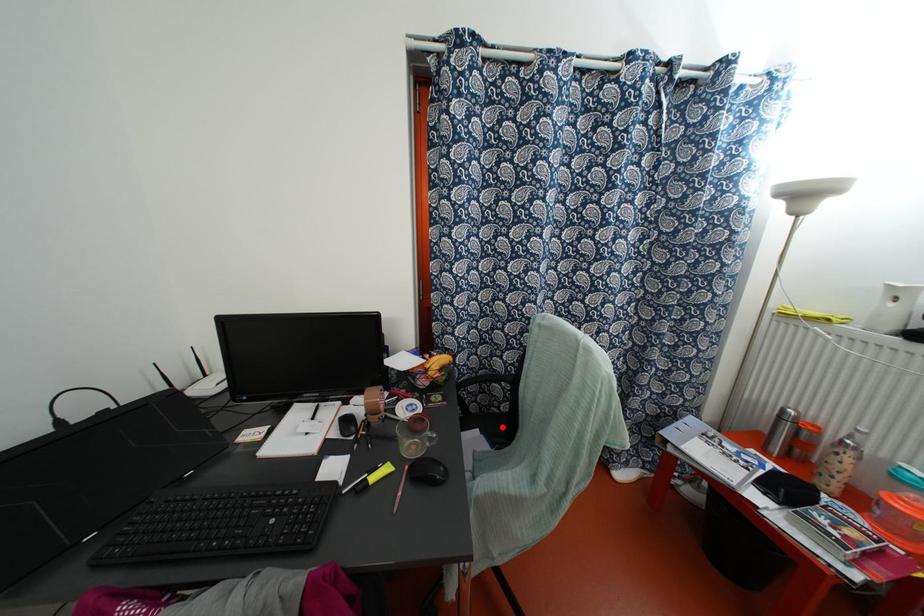
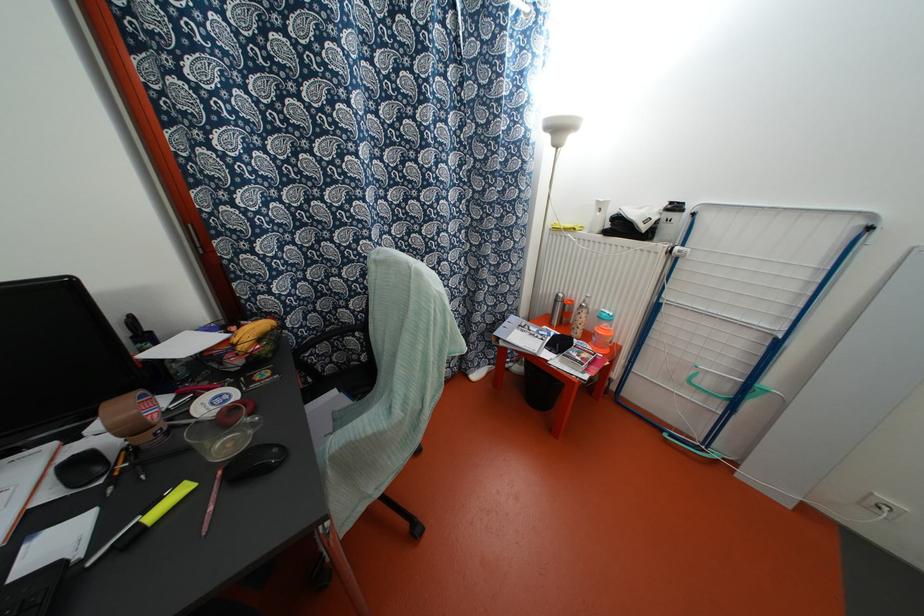
Where in the second image is the point corresponding to the highlighted location from the first image?

(362, 377)